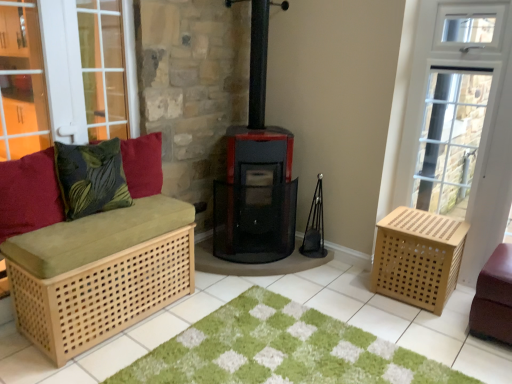
At what (x,y) coordinates should I click in order to perform the action: click on spots to the right of natural wood bench at left, which ranks as the first furniture in left-to-right order. Please return your answer as a coordinate pair (x, y). Looking at the image, I should click on (196, 302).